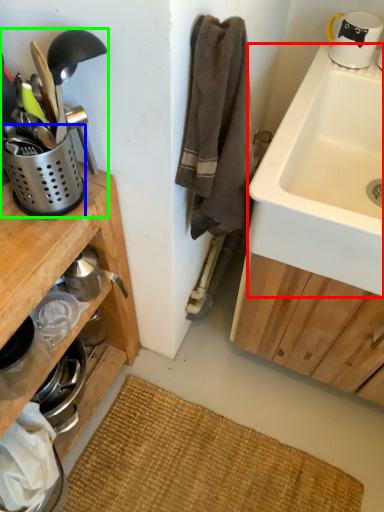
Question: Which object is the closest to the sink (highlighted by a red box)? Choose among these: appliance (highlighted by a blue box) or appliance (highlighted by a green box).

Choices:
 (A) appliance
 (B) appliance

Answer: (B)